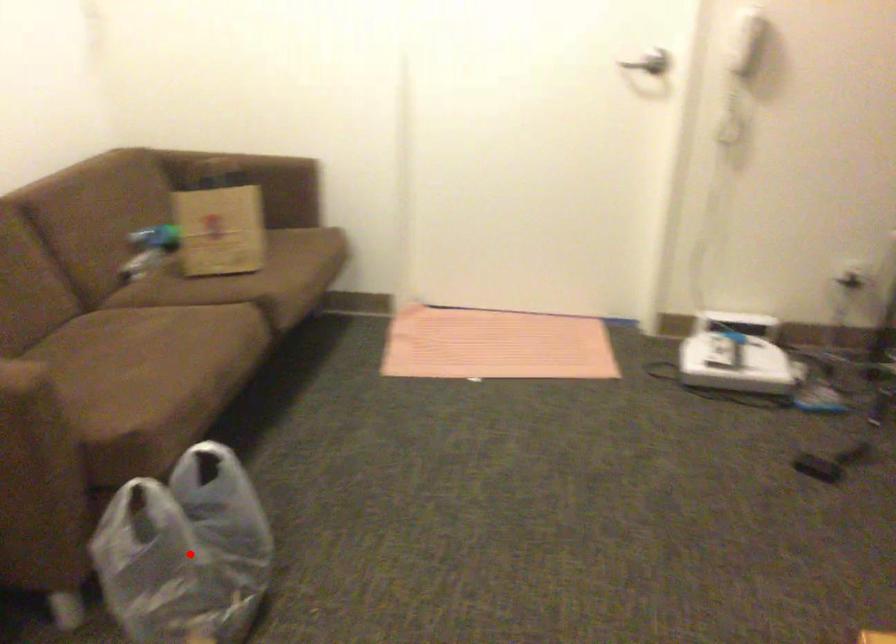
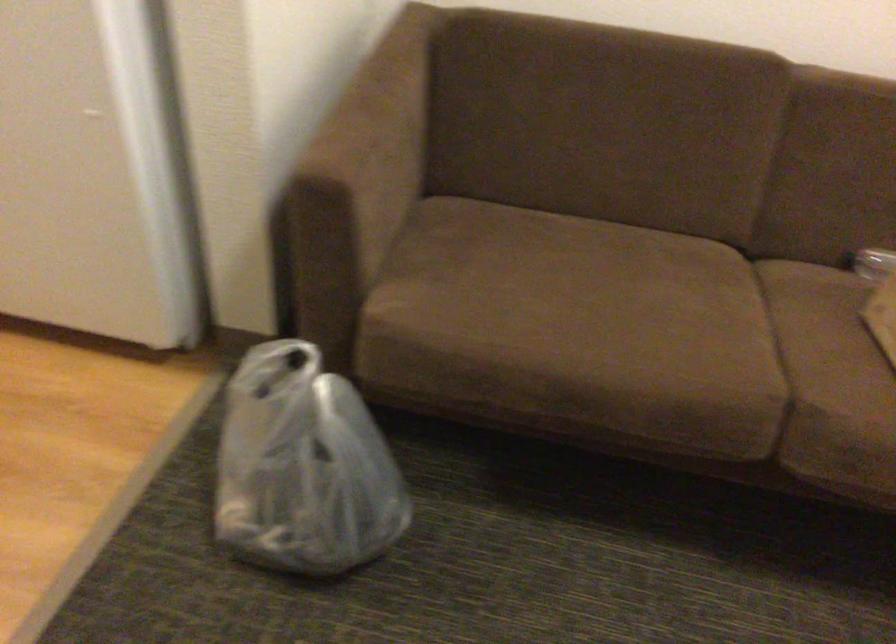
Question: I am providing you with two images of the same scene from different viewpoints. Image1 has a red point marked. In image2, the corresponding 3D location appears at what relative position? Reply with the corresponding letter.

Choices:
 (A) Closer
 (B) Farther

Answer: (A)